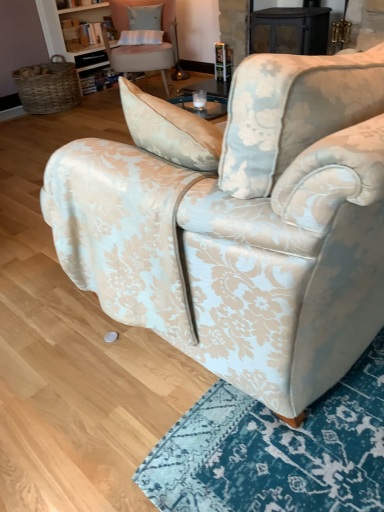
Where is `floral fabric armchair at center, arranged as the first chair when viewed from the right`? Image resolution: width=384 pixels, height=512 pixels. floral fabric armchair at center, arranged as the first chair when viewed from the right is located at coordinates (242, 227).

What do you see at coordinates (242, 227) in the screenshot?
I see `floral fabric armchair at center, positioned as the 2th chair in left-to-right order` at bounding box center [242, 227].

What is the approximate width of pastel pink fabric chair at upper center, the second chair viewed from the right?

pastel pink fabric chair at upper center, the second chair viewed from the right, is 27.09 inches in width.

How much space does pastel pink fabric chair at upper center, which appears as the 1th chair when viewed from the left, occupy vertically?

It is 34.10 inches.

What do you see at coordinates (143, 45) in the screenshot? I see `pastel pink fabric chair at upper center, the second chair viewed from the right` at bounding box center [143, 45].

Locate an element on the screen. pastel pink fabric chair at upper center, which appears as the 1th chair when viewed from the left is located at coordinates (143, 45).

Locate an element on the screen. floral fabric armchair at center, positioned as the 2th chair in left-to-right order is located at coordinates (242, 227).

Visually, is pastel pink fabric chair at upper center, the second chair viewed from the right, positioned to the left or to the right of floral fabric armchair at center, positioned as the 2th chair in left-to-right order?

pastel pink fabric chair at upper center, the second chair viewed from the right, is to the left of floral fabric armchair at center, positioned as the 2th chair in left-to-right order.

Looking at this image, is the depth of pastel pink fabric chair at upper center, which appears as the 1th chair when viewed from the left, greater than that of floral fabric armchair at center, positioned as the 2th chair in left-to-right order?

Yes, pastel pink fabric chair at upper center, which appears as the 1th chair when viewed from the left, is further from the camera.

Does point (164, 11) come in front of point (334, 127)?

No, (164, 11) is behind (334, 127).

From the image's perspective, would you say pastel pink fabric chair at upper center, the second chair viewed from the right, is shown under floral fabric armchair at center, arranged as the first chair when viewed from the right?

No, from the image's perspective, pastel pink fabric chair at upper center, the second chair viewed from the right, is not beneath floral fabric armchair at center, arranged as the first chair when viewed from the right.

From a real-world perspective, who is located higher, pastel pink fabric chair at upper center, which appears as the 1th chair when viewed from the left, or floral fabric armchair at center, positioned as the 2th chair in left-to-right order?

From a 3D spatial view, pastel pink fabric chair at upper center, which appears as the 1th chair when viewed from the left, is above.

Can you confirm if pastel pink fabric chair at upper center, which appears as the 1th chair when viewed from the left, is thinner than floral fabric armchair at center, arranged as the first chair when viewed from the right?

Yes.

From their relative heights in the image, would you say pastel pink fabric chair at upper center, which appears as the 1th chair when viewed from the left, is taller or shorter than floral fabric armchair at center, positioned as the 2th chair in left-to-right order?

In the image, pastel pink fabric chair at upper center, which appears as the 1th chair when viewed from the left, appears to be taller than floral fabric armchair at center, positioned as the 2th chair in left-to-right order.

Is pastel pink fabric chair at upper center, which appears as the 1th chair when viewed from the left, bigger than floral fabric armchair at center, positioned as the 2th chair in left-to-right order?

No.

Could floral fabric armchair at center, positioned as the 2th chair in left-to-right order, be considered to be inside pastel pink fabric chair at upper center, the second chair viewed from the right?

No, pastel pink fabric chair at upper center, the second chair viewed from the right, does not contain floral fabric armchair at center, positioned as the 2th chair in left-to-right order.

Are pastel pink fabric chair at upper center, which appears as the 1th chair when viewed from the left, and floral fabric armchair at center, arranged as the first chair when viewed from the right, making contact?

No, pastel pink fabric chair at upper center, which appears as the 1th chair when viewed from the left, is not making contact with floral fabric armchair at center, arranged as the first chair when viewed from the right.

Could you tell me if pastel pink fabric chair at upper center, which appears as the 1th chair when viewed from the left, is facing floral fabric armchair at center, positioned as the 2th chair in left-to-right order?

Yes, pastel pink fabric chair at upper center, which appears as the 1th chair when viewed from the left, is aimed at floral fabric armchair at center, positioned as the 2th chair in left-to-right order.

Measure the distance from pastel pink fabric chair at upper center, the second chair viewed from the right, to floral fabric armchair at center, arranged as the first chair when viewed from the right.

pastel pink fabric chair at upper center, the second chair viewed from the right, is 3.45 meters away from floral fabric armchair at center, arranged as the first chair when viewed from the right.

Where is `chair that appears above the floral fabric armchair at center, arranged as the first chair when viewed from the right (from the image's perspective)`? This screenshot has width=384, height=512. chair that appears above the floral fabric armchair at center, arranged as the first chair when viewed from the right (from the image's perspective) is located at coordinates (143, 45).

Can you confirm if floral fabric armchair at center, positioned as the 2th chair in left-to-right order, is positioned to the right of pastel pink fabric chair at upper center, which appears as the 1th chair when viewed from the left?

Indeed, floral fabric armchair at center, positioned as the 2th chair in left-to-right order, is positioned on the right side of pastel pink fabric chair at upper center, which appears as the 1th chair when viewed from the left.

Which is behind, floral fabric armchair at center, positioned as the 2th chair in left-to-right order, or pastel pink fabric chair at upper center, which appears as the 1th chair when viewed from the left?

pastel pink fabric chair at upper center, which appears as the 1th chair when viewed from the left.

Is point (225, 194) in front of point (171, 64)?

Yes, it is in front of point (171, 64).

From the image's perspective, is floral fabric armchair at center, arranged as the first chair when viewed from the right, on pastel pink fabric chair at upper center, which appears as the 1th chair when viewed from the left?

No, from the image's perspective, floral fabric armchair at center, arranged as the first chair when viewed from the right, is not above pastel pink fabric chair at upper center, which appears as the 1th chair when viewed from the left.

From a real-world perspective, is floral fabric armchair at center, positioned as the 2th chair in left-to-right order, above or below pastel pink fabric chair at upper center, the second chair viewed from the right?

floral fabric armchair at center, positioned as the 2th chair in left-to-right order, is situated lower than pastel pink fabric chair at upper center, the second chair viewed from the right, in the real world.

Between floral fabric armchair at center, arranged as the first chair when viewed from the right, and pastel pink fabric chair at upper center, the second chair viewed from the right, which one has smaller width?

pastel pink fabric chair at upper center, the second chair viewed from the right.

Considering the sizes of objects floral fabric armchair at center, positioned as the 2th chair in left-to-right order, and pastel pink fabric chair at upper center, the second chair viewed from the right, in the image provided, who is shorter, floral fabric armchair at center, positioned as the 2th chair in left-to-right order, or pastel pink fabric chair at upper center, the second chair viewed from the right,?

floral fabric armchair at center, positioned as the 2th chair in left-to-right order, is shorter.

Does floral fabric armchair at center, positioned as the 2th chair in left-to-right order, have a smaller size compared to pastel pink fabric chair at upper center, the second chair viewed from the right?

No, floral fabric armchair at center, positioned as the 2th chair in left-to-right order, is not smaller than pastel pink fabric chair at upper center, the second chair viewed from the right.

Would you say floral fabric armchair at center, positioned as the 2th chair in left-to-right order, is outside pastel pink fabric chair at upper center, which appears as the 1th chair when viewed from the left?

Indeed, floral fabric armchair at center, positioned as the 2th chair in left-to-right order, is completely outside pastel pink fabric chair at upper center, which appears as the 1th chair when viewed from the left.

Is floral fabric armchair at center, arranged as the first chair when viewed from the right, next to pastel pink fabric chair at upper center, the second chair viewed from the right, and touching it?

There is a gap between floral fabric armchair at center, arranged as the first chair when viewed from the right, and pastel pink fabric chair at upper center, the second chair viewed from the right.

Is floral fabric armchair at center, positioned as the 2th chair in left-to-right order, oriented away from pastel pink fabric chair at upper center, the second chair viewed from the right?

No, floral fabric armchair at center, positioned as the 2th chair in left-to-right order, is not facing the opposite direction of pastel pink fabric chair at upper center, the second chair viewed from the right.

Locate an element on the screen. chair above the floral fabric armchair at center, arranged as the first chair when viewed from the right (from a real-world perspective) is located at coordinates (143, 45).

This screenshot has height=512, width=384. What are the coordinates of `chair above the floral fabric armchair at center, positioned as the 2th chair in left-to-right order (from a real-world perspective)` in the screenshot? It's located at click(143, 45).

The height and width of the screenshot is (512, 384). In order to click on chair to the left of floral fabric armchair at center, arranged as the first chair when viewed from the right in this screenshot , I will do `click(143, 45)`.